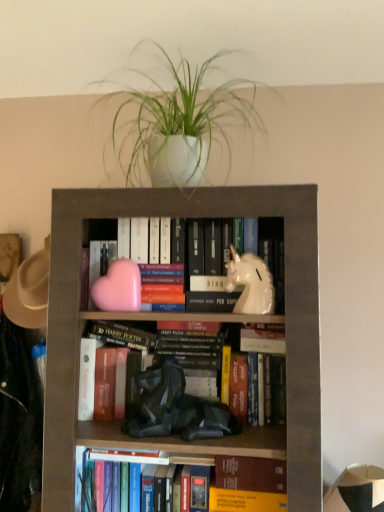
Question: From the image's perspective, is hardcover book at lower center located above or below pink matte heart at center, acting as the 1th animal starting from the left?

Choices:
 (A) above
 (B) below

Answer: (B)

Question: Would you say hardcover book at lower center is to the left or to the right of pink matte heart at center, acting as the 1th animal starting from the left, in the picture?

Choices:
 (A) right
 (B) left

Answer: (A)

Question: Which is farther from the brown felt hat at left?

Choices:
 (A) white matte plant at upper center
 (B) white glossy unicorn at center-right, marked as the 1th animal in a right-to-left arrangement
 (C) matte gray bookcase at center
 (D) pink matte heart at center, the second animal from the right
 (E) hardcover book at center

Answer: (B)

Question: Which of these objects is positioned closest to the hardcover book at center?

Choices:
 (A) pink matte heart at center, acting as the 1th animal starting from the left
 (B) brown felt hat at left
 (C) hardcover book at lower center
 (D) white glossy unicorn at center-right, the 2th animal in the left-to-right sequence
 (E) white matte plant at upper center

Answer: (C)